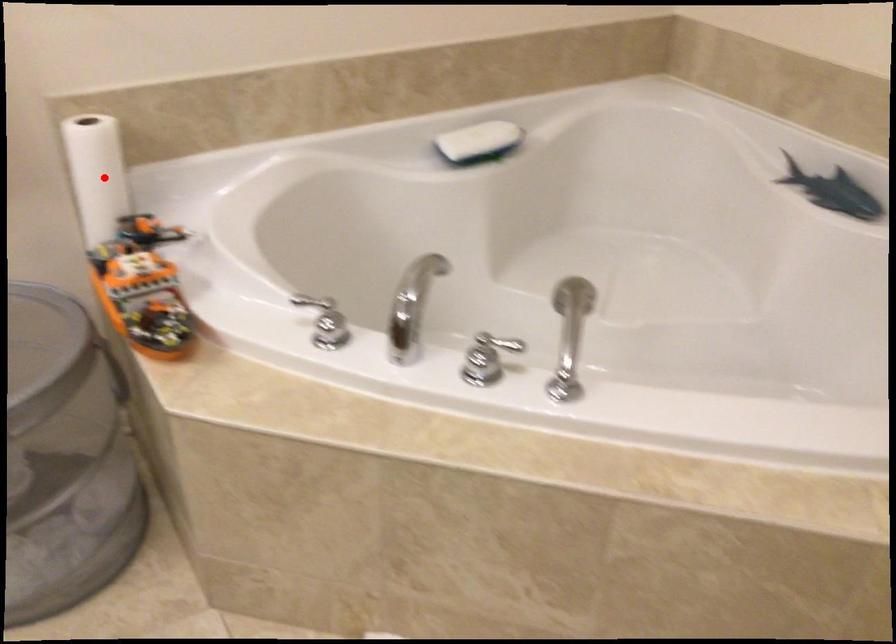
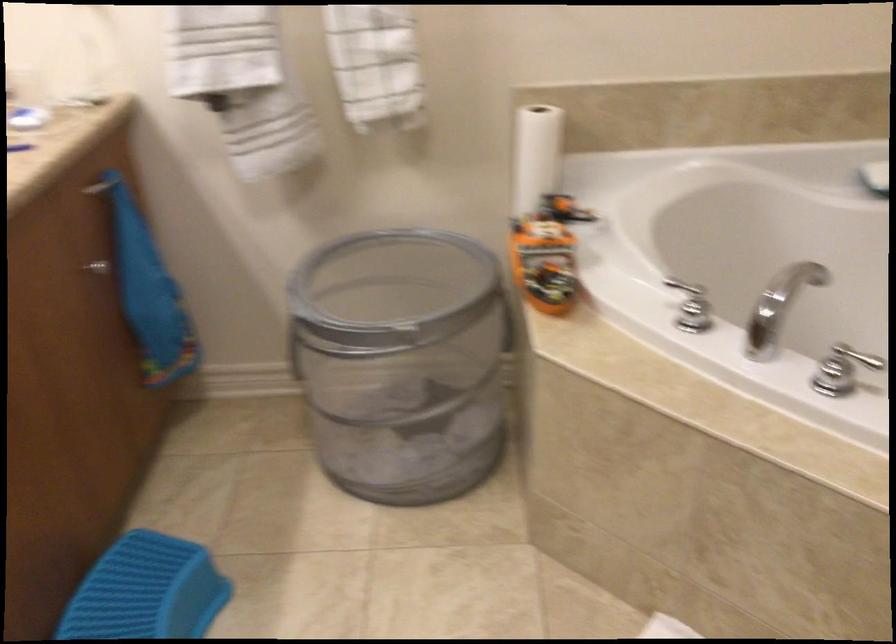
The point at the highlighted location is marked in the first image. Where is the corresponding point in the second image?

(536, 156)